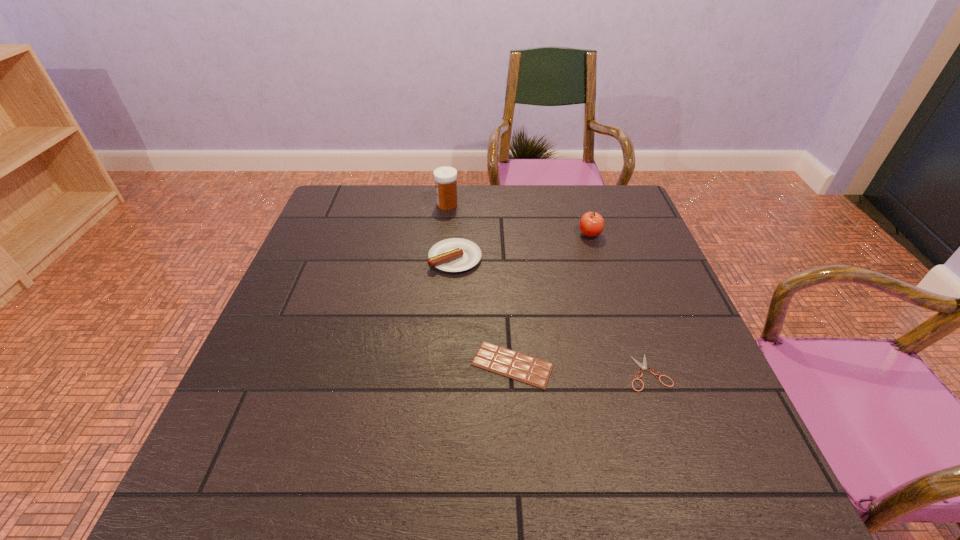
The height and width of the screenshot is (540, 960). What are the coordinates of `vacant area between the third shortest object and the medicine` in the screenshot? It's located at (451, 232).

This screenshot has width=960, height=540. Find the location of `blank region between the medicine and the sausage`. blank region between the medicine and the sausage is located at coordinates (451, 232).

Where is `vacant region between the fourth tallest object and the shears`? vacant region between the fourth tallest object and the shears is located at coordinates (581, 368).

Find the location of a particular element. unoccupied position between the farthest object and the chocolate bar is located at coordinates (480, 285).

The width and height of the screenshot is (960, 540). What are the coordinates of `vacant area that lies between the tallest object and the chocolate bar` in the screenshot? It's located at (480, 285).

At what (x,y) coordinates should I click in order to perform the action: click on vacant space that's between the farthest object and the chocolate bar. Please return your answer as a coordinate pair (x, y). The width and height of the screenshot is (960, 540). Looking at the image, I should click on [480, 285].

The width and height of the screenshot is (960, 540). In order to click on vacant area that lies between the medicine and the second shortest object in this screenshot , I will do `click(480, 285)`.

Find the location of a particular element. free spot between the farthest object and the second shortest object is located at coordinates (480, 285).

Find the location of a particular element. empty space that is in between the apple and the farthest object is located at coordinates (518, 220).

Locate an element on the screen. Image resolution: width=960 pixels, height=540 pixels. unoccupied area between the tallest object and the sausage is located at coordinates (451, 232).